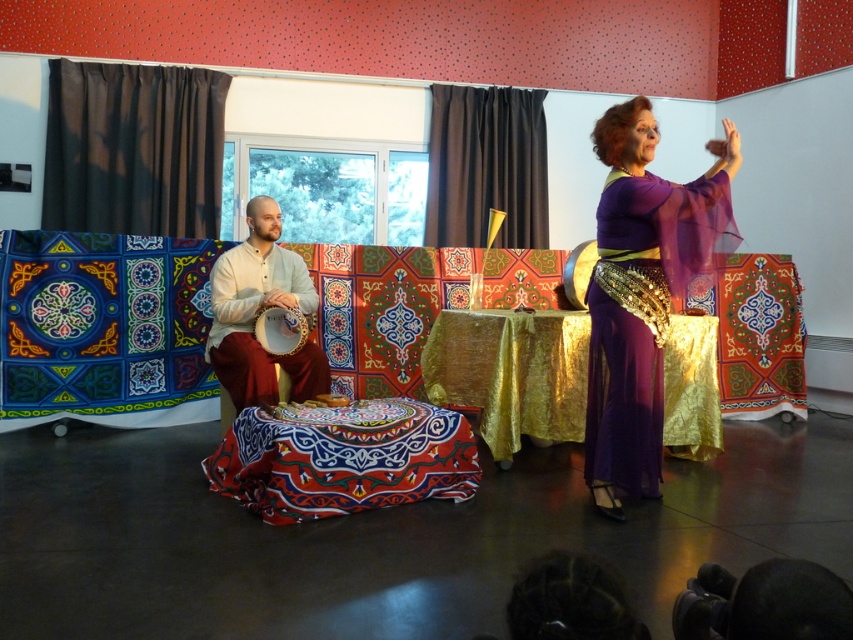
You are a photographer setting up for a cultural performance. You need to position your camera so that the black curtain at left is exactly 5 meters away from the camera. Based on the scene description, is your current position correct?

The black curtain at left is currently 5.21 meters from the camera. Since 5.21 meters is slightly more than 5 meters, your current position is not correct. You need to move the camera about 21 centimeters closer to the black curtain at left to achieve the desired distance.

In the scene shown: You are attending a cultural performance and see a gold shimmering tablecloth at center. Can you confirm if the point marked at coordinates (511, 372) is located on the gold shimmering tablecloth?

The gold shimmering tablecloth at center is represented by point (511, 372), so yes, the point is located on the gold shimmering tablecloth.

From the picture: You are an event organizer setting up for a cultural performance. You notice the gold shimmering tablecloth at center and the black fabric curtain at upper center. Which object is located below the other?

The gold shimmering tablecloth at center is positioned under the black fabric curtain at upper center, meaning the tablecloth is below the curtain.